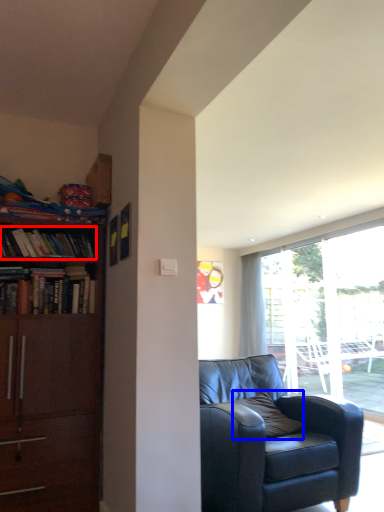
Question: Which object appears closest to the camera in this image, book (highlighted by a red box) or pillow (highlighted by a blue box)?

Choices:
 (A) book
 (B) pillow

Answer: (B)